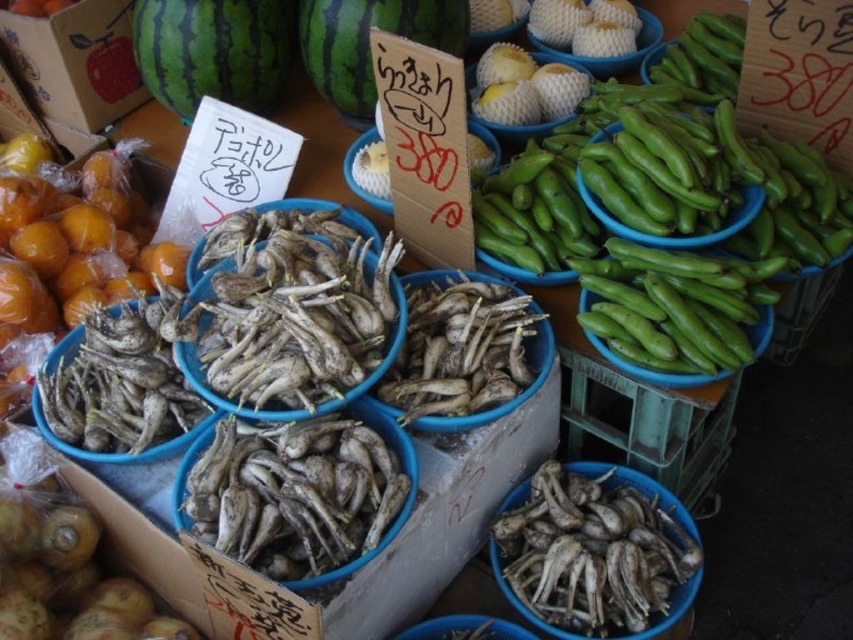
Question: Which point is farther to the camera?

Choices:
 (A) white matte root vegetables at lower center
 (B) green striped watermelon at upper center

Answer: (B)

Question: Is white matte root vegetables at lower center wider than green striped watermelon at upper left?

Choices:
 (A) no
 (B) yes

Answer: (A)

Question: Which point is farther to the camera?

Choices:
 (A) green striped watermelon at upper left
 (B) white matte root vegetables at lower center

Answer: (A)

Question: From the image, what is the correct spatial relationship of white matte root vegetables at lower center in relation to green striped watermelon at upper center?

Choices:
 (A) right
 (B) left

Answer: (A)

Question: Among these points, which one is nearest to the camera?

Choices:
 (A) (341, 3)
 (B) (231, 80)
 (C) (631, 618)

Answer: (C)

Question: Does white matte root vegetables at lower center have a larger size compared to green striped watermelon at upper center?

Choices:
 (A) no
 (B) yes

Answer: (A)